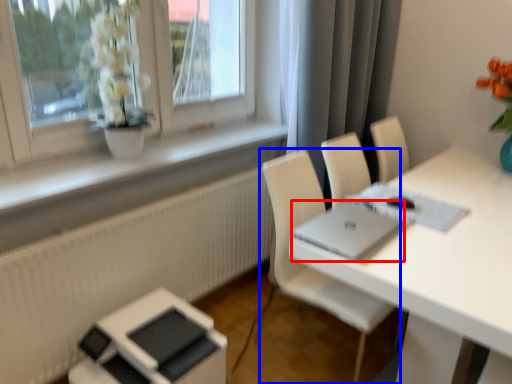
Question: Which object appears farthest to the camera in this image, laptop (highlighted by a red box) or chair (highlighted by a blue box)?

Choices:
 (A) laptop
 (B) chair

Answer: (B)